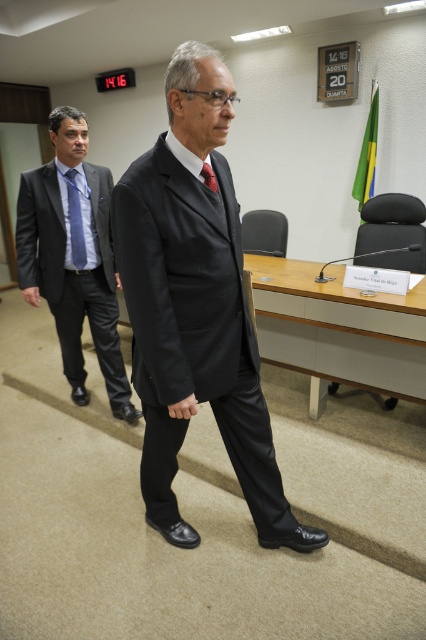
You are an event planner setting up a seating arrangement. You need to place a chair to the right of the matte black suit at left and another chair to the left of the blue striped tie at left. Based on their positions, which chair will be closer to the center of the room?

The chair placed to the left of the blue striped tie at left will be closer to the center of the room because the matte black suit at left is positioned to the left of the blue striped tie at left, meaning the blue striped tie at left is closer to the center than the matte black suit at left.

You are a security guard in the room and need to approach the person wearing the blue striped tie at left. Which direction should you move relative to the matte black suit at center?

The matte black suit at center is closer to the viewer than the blue striped tie at left, so you should move backward away from the matte black suit at center to reach the blue striped tie at left.

You are an event planner arranging seating for a formal event. You need to place two guests wearing matte black suits in specific positions. The guest in the matte black suit at center and the guest in the matte black suit at left must be seated such that their positions reflect their original spatial relationship in the image. Where should each guest be seated relative to each other?

The matte black suit at center should be seated directly below the matte black suit at left, maintaining their original vertical alignment as seen in the image.